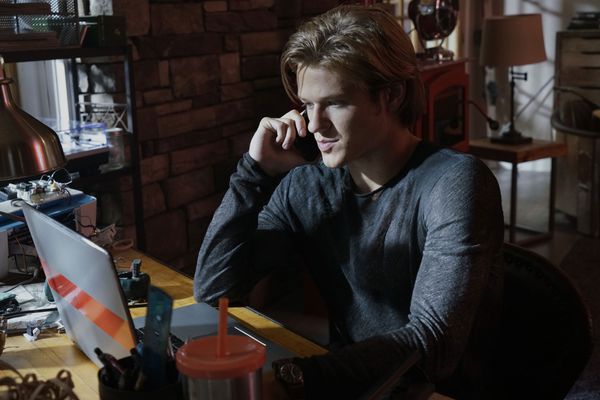
This screenshot has width=600, height=400. I want to click on table, so click(x=514, y=155).